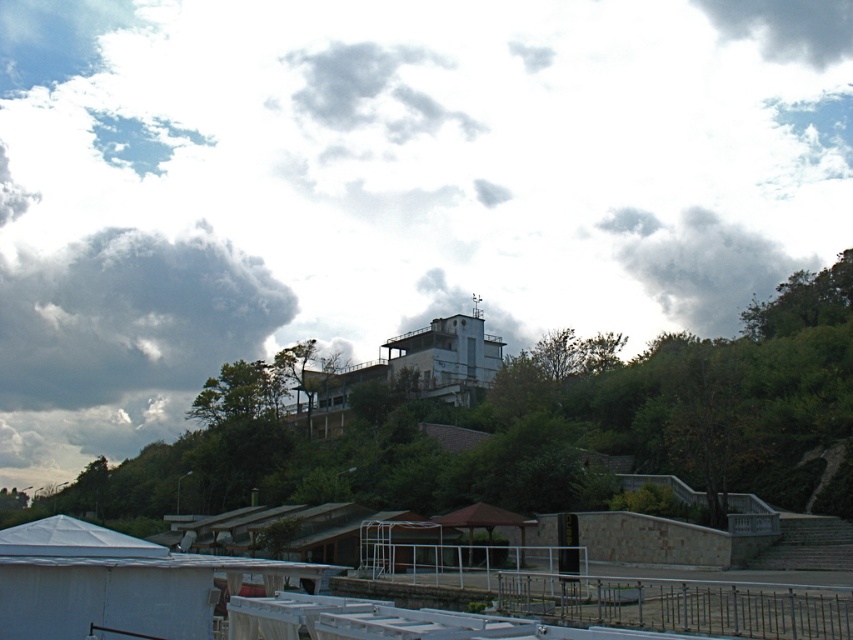
Between dark gray fluffy cloud at upper left and dark gray cloud at upper right, which one has less height?

Standing shorter between the two is dark gray cloud at upper right.

Describe the element at coordinates (129, 316) in the screenshot. I see `dark gray fluffy cloud at upper left` at that location.

Which is in front, point (137, 362) or point (842, 38)?

Point (137, 362)

Identify the location of dark gray fluffy cloud at upper left. (129, 316).

Which is in front, point (192, 337) or point (694, 291)?

Point (694, 291)

Is dark gray fluffy cloud at upper left smaller than gray fluffy cloud at upper right?

Incorrect, dark gray fluffy cloud at upper left is not smaller in size than gray fluffy cloud at upper right.

Does point (172, 280) come behind point (642, 244)?

Yes.

The width and height of the screenshot is (853, 640). Identify the location of dark gray fluffy cloud at upper left. (129, 316).

Can you confirm if gray fluffy cloud at upper right is shorter than dark gray cloud at upper right?

Incorrect, gray fluffy cloud at upper right's height does not fall short of dark gray cloud at upper right's.

Does gray fluffy cloud at upper right appear over dark gray cloud at upper right?

No, gray fluffy cloud at upper right is not above dark gray cloud at upper right.

Is point (695, 296) farther from camera compared to point (793, 44)?

No, (695, 296) is in front of (793, 44).

Identify the location of gray fluffy cloud at upper right. The image size is (853, 640). (699, 264).